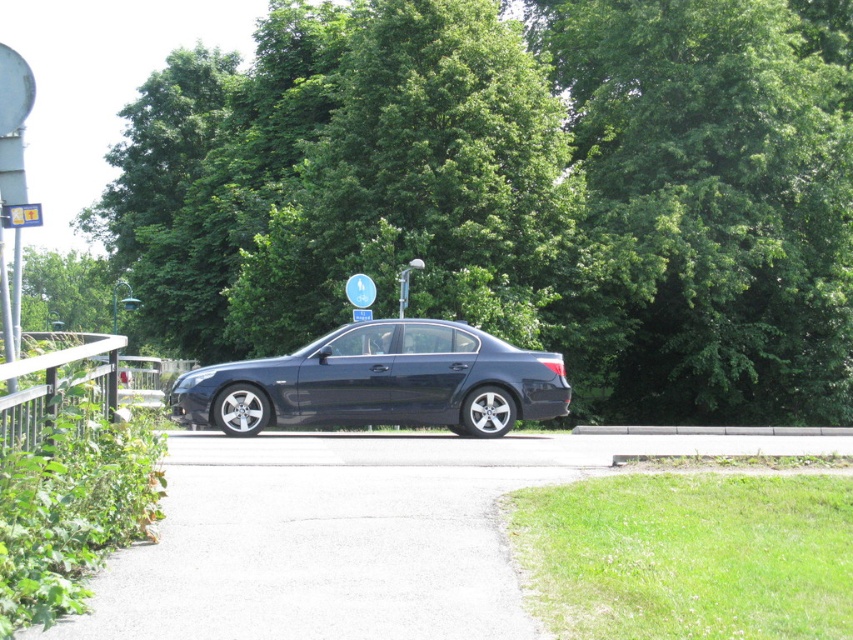
Can you confirm if green leafy tree at center is positioned above green leafy tree at upper center?

Yes.

Does point (85, 221) come closer to viewer compared to point (26, 321)?

That is True.

Where is `green leafy tree at center`? green leafy tree at center is located at coordinates (517, 189).

Is green leafy tree at center in front of black metal rail at left?

No.

Does green leafy tree at center have a lesser height compared to black metal rail at left?

In fact, green leafy tree at center may be taller than black metal rail at left.

Is point (328, 156) positioned behind point (71, 360)?

That is True.

Where is `green leafy tree at center`? Image resolution: width=853 pixels, height=640 pixels. green leafy tree at center is located at coordinates (517, 189).

Who is more distant from viewer, (532,403) or (30,248)?

Point (30,248)

This screenshot has height=640, width=853. Identify the location of glossy black sedan at center. (380, 381).